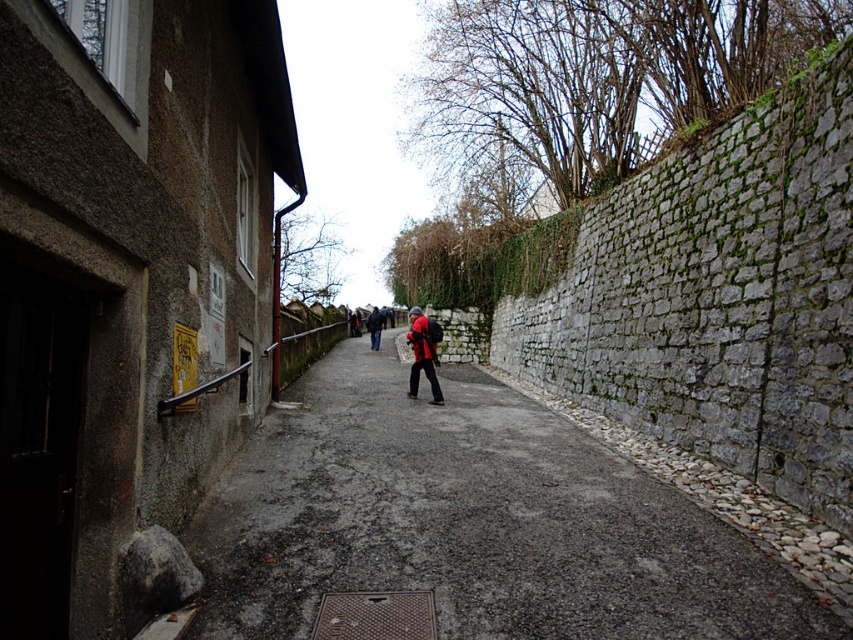
The width and height of the screenshot is (853, 640). What do you see at coordinates (422, 355) in the screenshot? I see `matte black jacket at center` at bounding box center [422, 355].

Locate an element on the screen. matte black jacket at center is located at coordinates (422, 355).

Who is more forward, [415,384] or [379,314]?

Point [415,384] is in front.

Find the location of a particular element. matte black jacket at center is located at coordinates (422, 355).

From the picture: Between smooth concrete alley at center and matte red jacket at center, which one has more height?

Standing taller between the two is matte red jacket at center.

Does point (505, 609) come farther from viewer compared to point (415, 332)?

No, it is in front of (415, 332).

Where is `smooth concrete alley at center`? smooth concrete alley at center is located at coordinates (469, 522).

Between smooth concrete alley at center and matte black jacket at center, which one has more height?

matte black jacket at center is taller.

The width and height of the screenshot is (853, 640). In order to click on smooth concrete alley at center in this screenshot , I will do `click(469, 522)`.

The image size is (853, 640). I want to click on smooth concrete alley at center, so (469, 522).